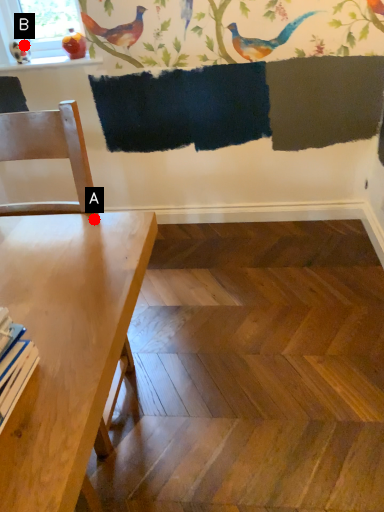
Question: Two points are circled on the image, labeled by A and B beside each circle. Which point appears farthest from the camera in this image?

Choices:
 (A) A is further
 (B) B is further

Answer: (B)